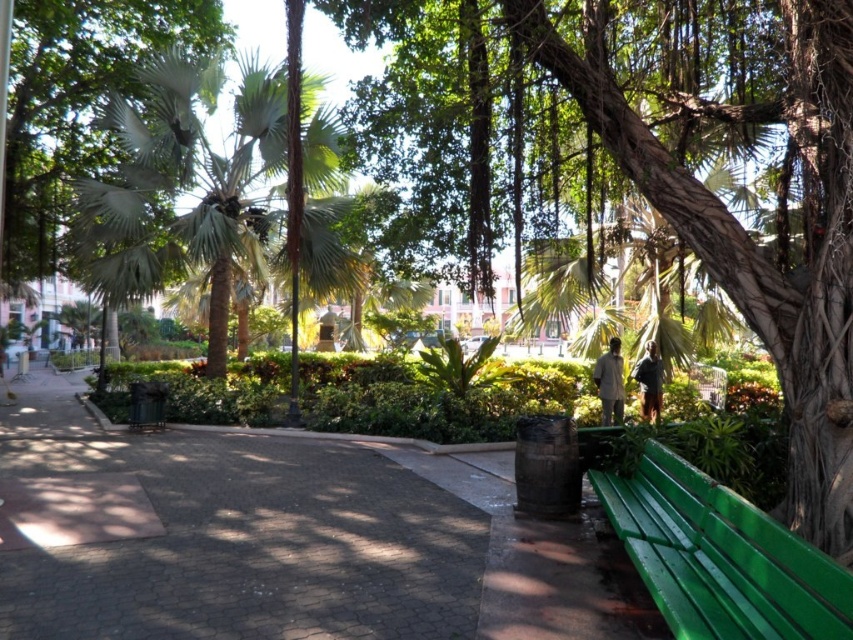
Question: From the image, what is the correct spatial relationship of green textured bench at right in relation to light brown fabric shirt at center?

Choices:
 (A) right
 (B) left

Answer: (B)

Question: Considering the relative positions of dark gray cobblestone at center and green painted wood bench at lower right in the image provided, where is dark gray cobblestone at center located with respect to green painted wood bench at lower right?

Choices:
 (A) left
 (B) right

Answer: (A)

Question: Which of these objects is positioned closest to the dark gray cobblestone at center?

Choices:
 (A) light brown fabric shirt at center
 (B) green leafy palm tree at upper left
 (C) green textured bench at right
 (D) green painted wood bench at lower right

Answer: (D)

Question: Which object is farther from the camera taking this photo?

Choices:
 (A) green textured bench at right
 (B) green painted wood bench at lower right

Answer: (A)

Question: Which object is farther from the camera taking this photo?

Choices:
 (A) green leafy palm tree at upper left
 (B) green textured bench at right
 (C) dark gray cobblestone at center

Answer: (A)

Question: Can you confirm if green leafy palm tree at upper left is positioned below green painted wood bench at lower right?

Choices:
 (A) no
 (B) yes

Answer: (A)